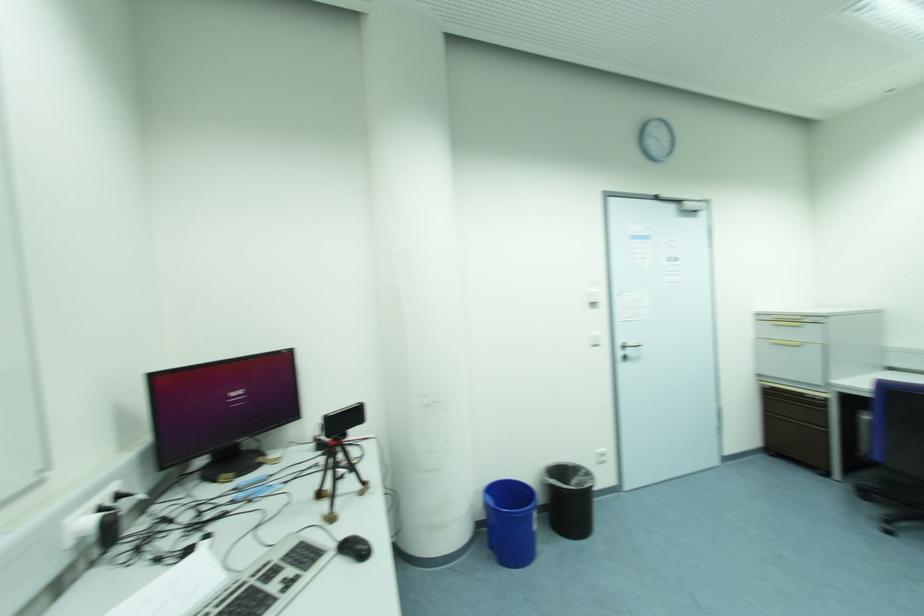
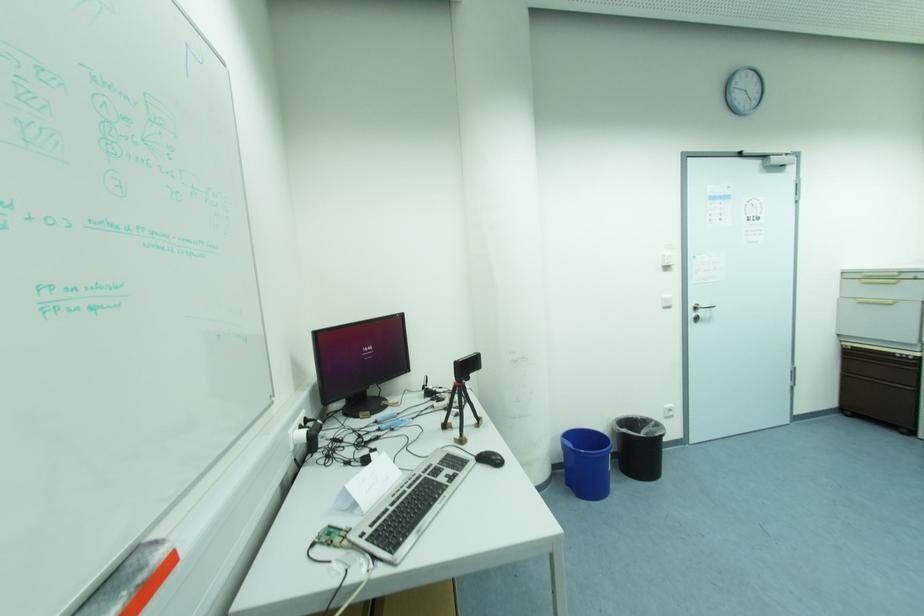
Find the pixel in the second image that matches the point at 360,546 in the first image.

(494, 458)